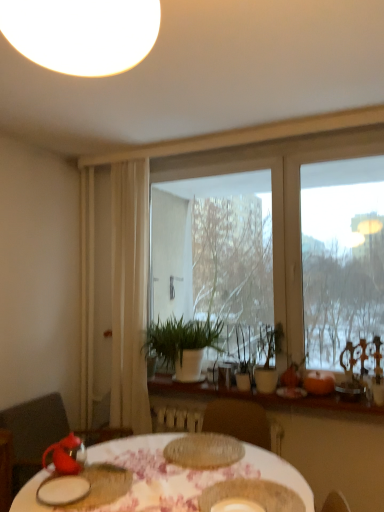
Where is `translucent glass plate at center, the 7th tableware in the right-to-left sequence`? This screenshot has height=512, width=384. translucent glass plate at center, the 7th tableware in the right-to-left sequence is located at coordinates (204, 451).

How much space does orange matte pumpkin at right, arranged as the 2th tableware when viewed from the right, occupy vertically?

5.86 inches.

Measure the distance between white ceramic plate at lower left, which ranks as the second tableware in left-to-right order, and camera.

white ceramic plate at lower left, which ranks as the second tableware in left-to-right order, is 5.04 feet from camera.

This screenshot has height=512, width=384. Identify the location of white ceramic plate at lower left, which appears as the 9th tableware when viewed from the right. (62, 490).

This screenshot has width=384, height=512. What do you see at coordinates (237, 505) in the screenshot?
I see `matte brown plate at center, the 5th tableware viewed from the left` at bounding box center [237, 505].

Where is `metallic silver tray at right, marked as the first tableware in a right-to-left arrangement`? This screenshot has width=384, height=512. metallic silver tray at right, marked as the first tableware in a right-to-left arrangement is located at coordinates (350, 390).

The height and width of the screenshot is (512, 384). Find the location of `matte ceramic bowl at center, which appears as the fourth tableware when viewed from the right`. matte ceramic bowl at center, which appears as the fourth tableware when viewed from the right is located at coordinates (253, 495).

Where is `translucent glass plate at center, which is the fourth tableware from left to right`? The width and height of the screenshot is (384, 512). translucent glass plate at center, which is the fourth tableware from left to right is located at coordinates (204, 451).

Considering the sizes of objects wooden at center and translucent glass plate at center, the 7th tableware in the right-to-left sequence, in the image provided, who is smaller, wooden at center or translucent glass plate at center, the 7th tableware in the right-to-left sequence,?

translucent glass plate at center, the 7th tableware in the right-to-left sequence.

Is point (171, 381) closer or farther from the camera than point (227, 464)?

Point (171, 381).

Is wooden at center taller than translucent glass plate at center, which is the fourth tableware from left to right?

Correct, wooden at center is much taller as translucent glass plate at center, which is the fourth tableware from left to right.

Consider the image. How many degrees apart are the facing directions of matte ceramic bowl at center, which is the 7th tableware from left to right, and matte red teapot at lower left, which is the 10th tableware in right-to-left order?

The angle between the facing direction of matte ceramic bowl at center, which is the 7th tableware from left to right, and the facing direction of matte red teapot at lower left, which is the 10th tableware in right-to-left order, is 0.00029 degrees.

Can you confirm if matte ceramic bowl at center, which appears as the fourth tableware when viewed from the right, is smaller than matte red teapot at lower left, which is the 10th tableware in right-to-left order?

Indeed, matte ceramic bowl at center, which appears as the fourth tableware when viewed from the right, has a smaller size compared to matte red teapot at lower left, which is the 10th tableware in right-to-left order.

From the matte red teapot at lower left, positioned as the first tableware in left-to-right order, count 6th tableware to the right and point to it. Please provide its 2D coordinates.

[(253, 495)]

From the image's perspective, which is below, matte ceramic bowl at center, which is the 7th tableware from left to right, or matte red teapot at lower left, positioned as the first tableware in left-to-right order?

matte ceramic bowl at center, which is the 7th tableware from left to right, from the image's perspective.

From the image's perspective, who appears lower, matte red teapot at lower left, the eighth tableware viewed from the right, or matte red teapot at lower left, which is the 10th tableware in right-to-left order?

From the image's view, matte red teapot at lower left, the eighth tableware viewed from the right, is below.

Is matte red teapot at lower left, the eighth tableware viewed from the right, bigger or smaller than matte red teapot at lower left, positioned as the first tableware in left-to-right order?

Clearly, matte red teapot at lower left, the eighth tableware viewed from the right, is smaller in size than matte red teapot at lower left, positioned as the first tableware in left-to-right order.

Which object is more forward, matte red teapot at lower left, the third tableware from the left, or matte red teapot at lower left, positioned as the first tableware in left-to-right order?

matte red teapot at lower left, the third tableware from the left, is more forward.

Would you say transparent glass window at center is inside or outside matte ceramic vase at lower right, the third tableware in the right-to-left sequence?

transparent glass window at center is located beyond the bounds of matte ceramic vase at lower right, the third tableware in the right-to-left sequence.

How far apart are transparent glass window at center and matte ceramic vase at lower right, the third tableware in the right-to-left sequence?

A distance of 1.19 meters exists between transparent glass window at center and matte ceramic vase at lower right, the third tableware in the right-to-left sequence.

What's the angular difference between transparent glass window at center and matte ceramic vase at lower right, the eighth tableware from the left,'s facing directions?

There is a 0.000478-degree angle between the facing directions of transparent glass window at center and matte ceramic vase at lower right, the eighth tableware from the left.

Is transparent glass window at center wider than matte ceramic vase at lower right, the third tableware in the right-to-left sequence?

No, transparent glass window at center is not wider than matte ceramic vase at lower right, the third tableware in the right-to-left sequence.

From a real-world perspective, is white ceramic plate at lower left, which appears as the 9th tableware when viewed from the right, beneath matte red teapot at lower left, positioned as the first tableware in left-to-right order?

Indeed, from a real-world perspective, white ceramic plate at lower left, which appears as the 9th tableware when viewed from the right, is positioned beneath matte red teapot at lower left, positioned as the first tableware in left-to-right order.

How distant is white ceramic plate at lower left, which ranks as the second tableware in left-to-right order, from matte red teapot at lower left, positioned as the first tableware in left-to-right order?

4.18 inches.

From the matte red teapot at lower left, positioned as the first tableware in left-to-right order, count 1st tableware to the right and point to it. Please provide its 2D coordinates.

[(62, 490)]

Between white ceramic plate at lower left, which ranks as the second tableware in left-to-right order, and matte red teapot at lower left, positioned as the first tableware in left-to-right order, which one has less height?

white ceramic plate at lower left, which ranks as the second tableware in left-to-right order.

Is translucent glass plate at center, the 7th tableware in the right-to-left sequence, oriented towards matte brown plate at center, the 5th tableware viewed from the left?

Yes, translucent glass plate at center, the 7th tableware in the right-to-left sequence, is aimed at matte brown plate at center, the 5th tableware viewed from the left.

Between translucent glass plate at center, the 7th tableware in the right-to-left sequence, and matte brown plate at center, which appears as the 6th tableware when viewed from the right, which one is positioned behind?

translucent glass plate at center, the 7th tableware in the right-to-left sequence, is more distant.

How many degrees apart are the facing directions of translucent glass plate at center, which is the fourth tableware from left to right, and matte brown plate at center, which appears as the 6th tableware when viewed from the right?

There is a 6.88-degree angle between the facing directions of translucent glass plate at center, which is the fourth tableware from left to right, and matte brown plate at center, which appears as the 6th tableware when viewed from the right.

From the image's perspective, which object appears higher, translucent glass plate at center, which is the fourth tableware from left to right, or matte brown plate at center, the 5th tableware viewed from the left?

matte brown plate at center, the 5th tableware viewed from the left, is shown above in the image.

Is matte glass vase at center, placed as the fifth tableware when sorted from right to left, smaller than matte red teapot at lower left, the third tableware from the left?

Yes.

What's the angular difference between matte glass vase at center, placed as the fifth tableware when sorted from right to left, and matte red teapot at lower left, the third tableware from the left,'s facing directions?

There is a 6.78-degree angle between the facing directions of matte glass vase at center, placed as the fifth tableware when sorted from right to left, and matte red teapot at lower left, the third tableware from the left.

The height and width of the screenshot is (512, 384). In order to click on the 9th tableware directly beneath the matte glass vase at center, acting as the 6th tableware starting from the left (from a real-world perspective) in this screenshot , I will do `click(97, 487)`.

In the scene shown: Between matte glass vase at center, acting as the 6th tableware starting from the left, and matte red teapot at lower left, the third tableware from the left, which one appears on the right side from the viewer's perspective?

matte glass vase at center, acting as the 6th tableware starting from the left.

From the wooden at center, count the 4th tableware to the left and point to it. Please provide its 2D coordinates.

[(204, 451)]

Locate an element on the screen. the 4th tableware positioned below the matte red teapot at lower left, positioned as the first tableware in left-to-right order (from a real-world perspective) is located at coordinates (253, 495).

Based on their spatial positions, is orange matte pumpkin at right, the 9th tableware from the left, or matte red teapot at lower left, positioned as the first tableware in left-to-right order, further from matte glass vase at center, acting as the 6th tableware starting from the left?

matte red teapot at lower left, positioned as the first tableware in left-to-right order, is positioned further to the anchor matte glass vase at center, acting as the 6th tableware starting from the left.

When comparing their distances from white sheer curtain at left, does matte glass vase at center, placed as the fifth tableware when sorted from right to left, or matte red teapot at lower left, positioned as the first tableware in left-to-right order, seem further?

matte red teapot at lower left, positioned as the first tableware in left-to-right order, lies further to white sheer curtain at left than the other object.

Looking at the image, which one is located further to white floral table at center, white sheer curtain at left or matte brown plate at center, which appears as the 6th tableware when viewed from the right?

white sheer curtain at left is positioned further to the anchor white floral table at center.

Consider the image. When comparing their distances from metallic silver tray at right, marked as the first tableware in a right-to-left arrangement, does matte red teapot at lower left, which is the 10th tableware in right-to-left order, or wooden at center seem closer?

wooden at center lies closer to metallic silver tray at right, marked as the first tableware in a right-to-left arrangement, than the other object.

Which object lies further to the anchor point white sheer curtain at left, metallic silver tray at right, marked as the first tableware in a right-to-left arrangement, or white ceramic plate at lower left, which appears as the 9th tableware when viewed from the right?

Among the two, metallic silver tray at right, marked as the first tableware in a right-to-left arrangement, is located further to white sheer curtain at left.

Which object lies further to the anchor point matte brown plate at center, the 5th tableware viewed from the left, matte glass vase at center, placed as the fifth tableware when sorted from right to left, or matte ceramic vase at lower right, the third tableware in the right-to-left sequence?

matte glass vase at center, placed as the fifth tableware when sorted from right to left, is further to matte brown plate at center, the 5th tableware viewed from the left.

Estimate the real-world distances between objects in this image. Which object is closer to wooden at center, white ceramic plate at lower left, which appears as the 9th tableware when viewed from the right, or matte glass vase at center, acting as the 6th tableware starting from the left?

The object closer to wooden at center is matte glass vase at center, acting as the 6th tableware starting from the left.

Estimate the real-world distances between objects in this image. Which object is further from matte ceramic bowl at center, which appears as the fourth tableware when viewed from the right, wooden at center or orange matte pumpkin at right, arranged as the 2th tableware when viewed from the right?

orange matte pumpkin at right, arranged as the 2th tableware when viewed from the right.

Identify the location of window sill located between white ceramic plate at lower left, which appears as the 9th tableware when viewed from the right, and transparent glass window at center in the depth direction. (254, 399).

Where is `window between matte brown plate at center, which appears as the 6th tableware when viewed from the right, and white matte plant at center, along the z-axis`? The height and width of the screenshot is (512, 384). window between matte brown plate at center, which appears as the 6th tableware when viewed from the right, and white matte plant at center, along the z-axis is located at coordinates (280, 203).

I want to click on window located between matte red teapot at lower left, positioned as the first tableware in left-to-right order, and metallic silver tray at right, which is counted as the 10th tableware, starting from the left, in the left-right direction, so tap(280, 203).

You are a GUI agent. You are given a task and a screenshot of the screen. Output one action in this format:
    pyautogui.click(x=<x>, y=<y>)
    Task: Click on the window sill between translucent glass plate at center, which is the fourth tableware from left to right, and white matte plant at center from front to back
    The height and width of the screenshot is (512, 384).
    Given the screenshot: What is the action you would take?
    pyautogui.click(x=254, y=399)